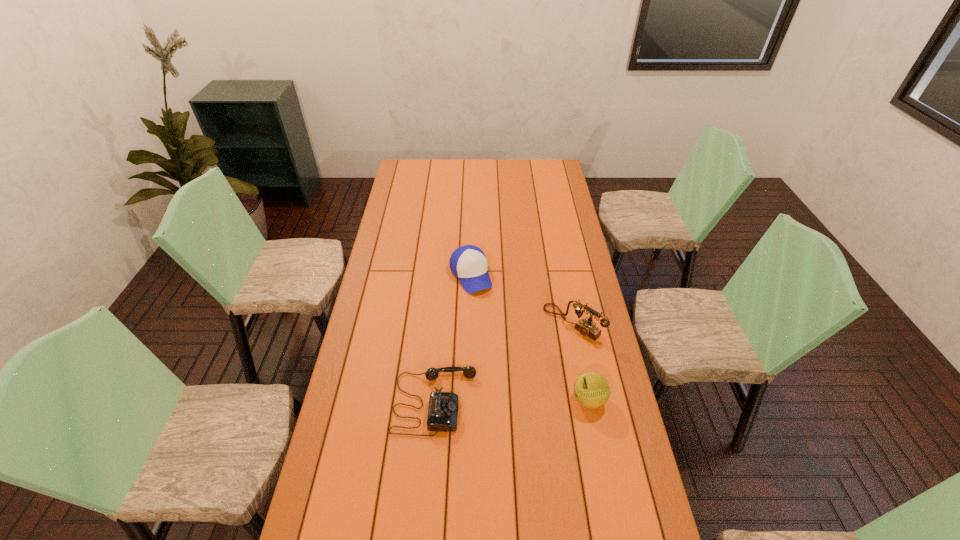
Locate an element on the screen. free space on the desktop that is between the nearer telephone and the softball and is positioned on the front-facing side of the second farthest object is located at coordinates (493, 401).

Find the location of `vacant space on the desktop that is between the nearer telephone and the softball and is positioned on the front-facing side of the farthest object`. vacant space on the desktop that is between the nearer telephone and the softball and is positioned on the front-facing side of the farthest object is located at coordinates (530, 400).